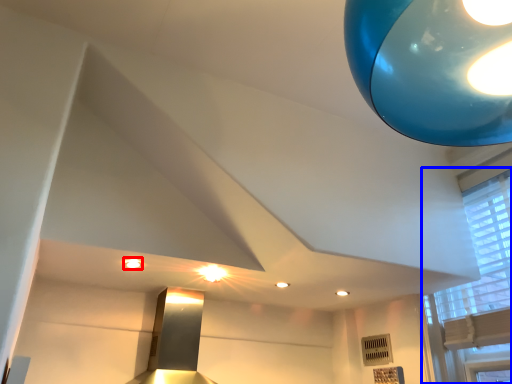
Question: Which object appears farthest to the camera in this image, lighting (highlighted by a red box) or window (highlighted by a blue box)?

Choices:
 (A) lighting
 (B) window

Answer: (A)